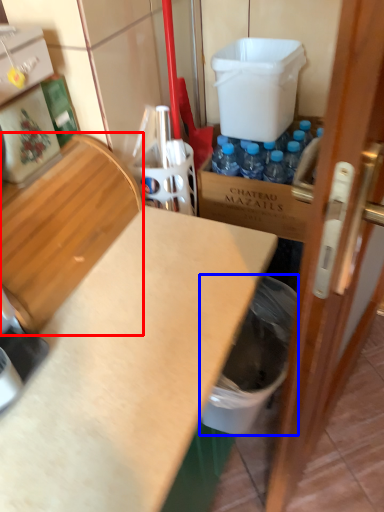
Question: Which point is closer to the camera, wood (highlighted by a red box) or garbage (highlighted by a blue box)?

Choices:
 (A) wood
 (B) garbage

Answer: (A)